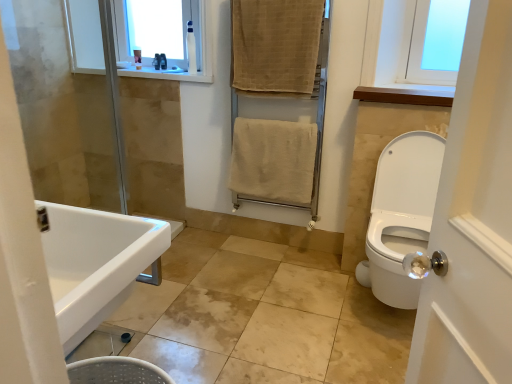
Locate an element on the screen. free space above beige textured towel rack at center (from a real-world perspective) is located at coordinates (275, 0).